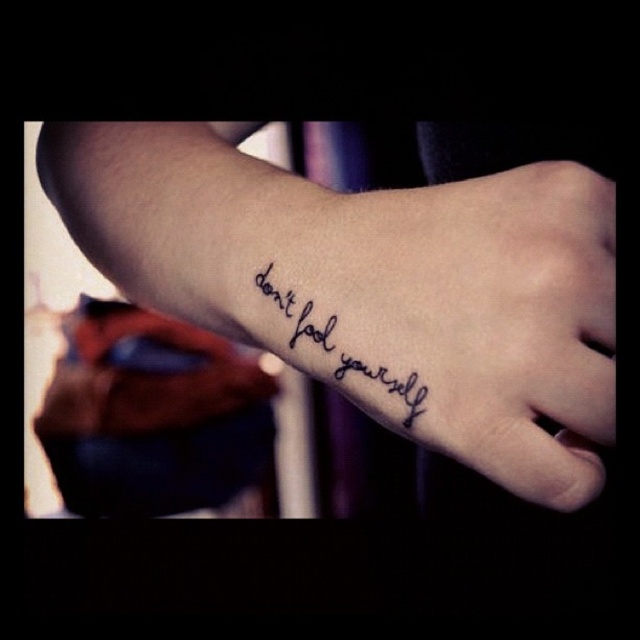
Question: From the image, what is the correct spatial relationship of black ink tattoo at lower center in relation to black ink text at lower left?

Choices:
 (A) above
 (B) below

Answer: (A)

Question: Among these points, which one is farthest from the camera?

Choices:
 (A) (381, 394)
 (B) (602, 388)

Answer: (A)

Question: Does black ink tattoo at lower center appear over black ink text at lower left?

Choices:
 (A) yes
 (B) no

Answer: (A)

Question: Does black ink tattoo at lower center appear under black ink text at lower left?

Choices:
 (A) yes
 (B) no

Answer: (B)